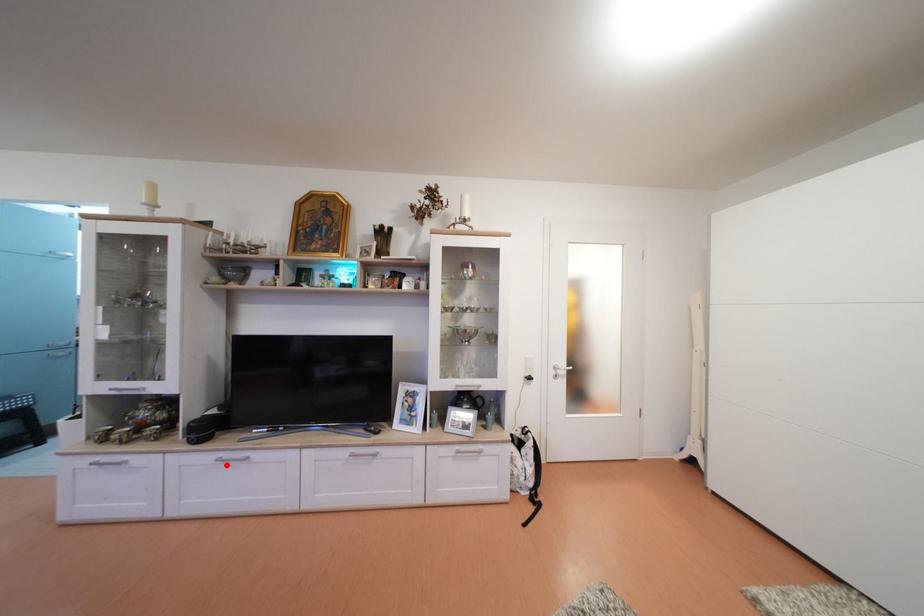
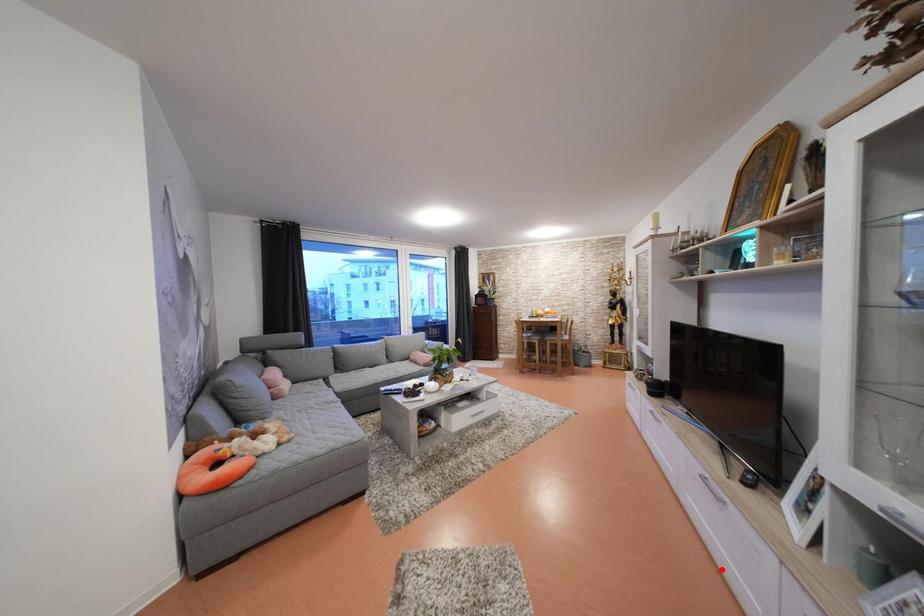
I am providing you with two images of the same scene from different viewpoints. A red point is marked on the first image and another point is marked on the second image. Does the point marked in image1 correspond to the same location as the one in image2?

No